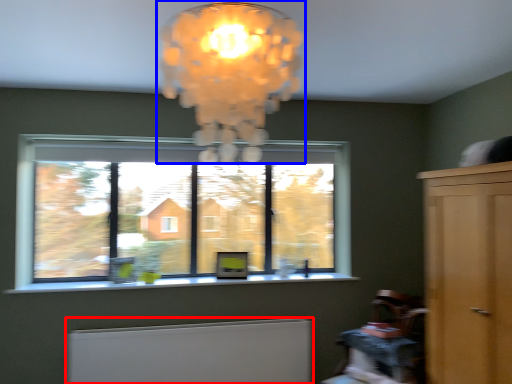
Question: Which point is further to the camera, radiator (highlighted by a red box) or lamp (highlighted by a blue box)?

Choices:
 (A) radiator
 (B) lamp

Answer: (A)